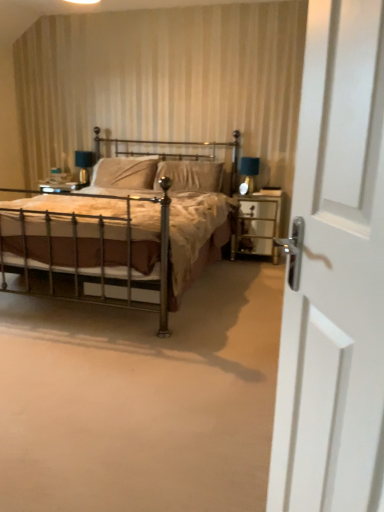
Question: Can you confirm if polished brass bed at center is wider than matte black table lamp at right, the 1th table lamp when ordered from right to left?

Choices:
 (A) no
 (B) yes

Answer: (B)

Question: Is the position of polished brass bed at center less distant than that of matte black table lamp at right, placed as the 2th table lamp when sorted from back to front?

Choices:
 (A) no
 (B) yes

Answer: (B)

Question: Is there a large distance between polished brass bed at center and matte black table lamp at right, arranged as the second table lamp when viewed from the left?

Choices:
 (A) no
 (B) yes

Answer: (B)

Question: Is polished brass bed at center facing towards matte black table lamp at right, arranged as the second table lamp when viewed from the left?

Choices:
 (A) yes
 (B) no

Answer: (B)

Question: From the image's perspective, does polished brass bed at center appear lower than matte black table lamp at right, placed as the 2th table lamp when sorted from back to front?

Choices:
 (A) yes
 (B) no

Answer: (A)

Question: From the image's perspective, is suede-like beige pillow at center, the 2th pillow positioned from the right, located above or below clear glass nightstand at right?

Choices:
 (A) below
 (B) above

Answer: (B)

Question: In terms of height, does suede-like beige pillow at center, the 2th pillow positioned from the right, look taller or shorter compared to clear glass nightstand at right?

Choices:
 (A) short
 (B) tall

Answer: (A)

Question: In terms of size, does suede-like beige pillow at center, which is the first pillow from left to right, appear bigger or smaller than clear glass nightstand at right?

Choices:
 (A) big
 (B) small

Answer: (A)

Question: In terms of width, does suede-like beige pillow at center, the 2th pillow positioned from the right, look wider or thinner when compared to clear glass nightstand at right?

Choices:
 (A) wide
 (B) thin

Answer: (B)

Question: Considering the positions of suede-like beige pillow at center, the 2th pillow positioned from the right, and polished brass bed at center in the image, is suede-like beige pillow at center, the 2th pillow positioned from the right, bigger or smaller than polished brass bed at center?

Choices:
 (A) big
 (B) small

Answer: (B)

Question: Is suede-like beige pillow at center, the 2th pillow positioned from the right, situated inside polished brass bed at center or outside?

Choices:
 (A) inside
 (B) outside

Answer: (A)

Question: In terms of width, does suede-like beige pillow at center, the 2th pillow positioned from the right, look wider or thinner when compared to polished brass bed at center?

Choices:
 (A) wide
 (B) thin

Answer: (B)

Question: Is suede-like beige pillow at center, the 2th pillow positioned from the right, in front of or behind polished brass bed at center in the image?

Choices:
 (A) behind
 (B) front

Answer: (A)

Question: From a real-world perspective, is suede-like beige pillow at center, the 1th pillow in the right-to-left sequence, positioned above or below matte black table lamp at right, which is counted as the 1th table lamp, starting from the front?

Choices:
 (A) below
 (B) above

Answer: (A)

Question: In terms of size, does suede-like beige pillow at center, the 1th pillow in the right-to-left sequence, appear bigger or smaller than matte black table lamp at right, arranged as the second table lamp when viewed from the left?

Choices:
 (A) big
 (B) small

Answer: (A)